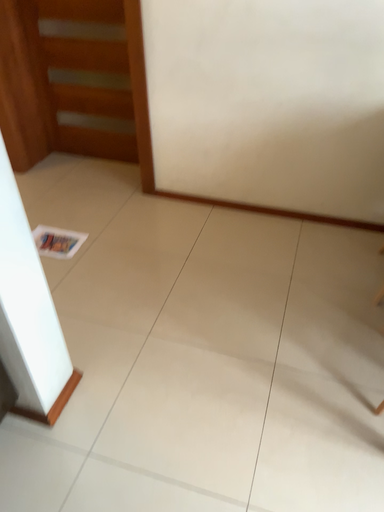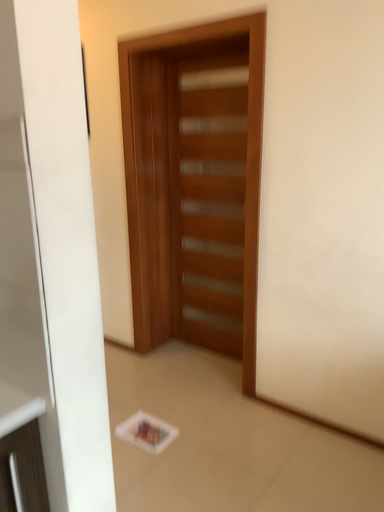
Question: Which way did the camera rotate in the video?

Choices:
 (A) rotated left
 (B) rotated right

Answer: (A)